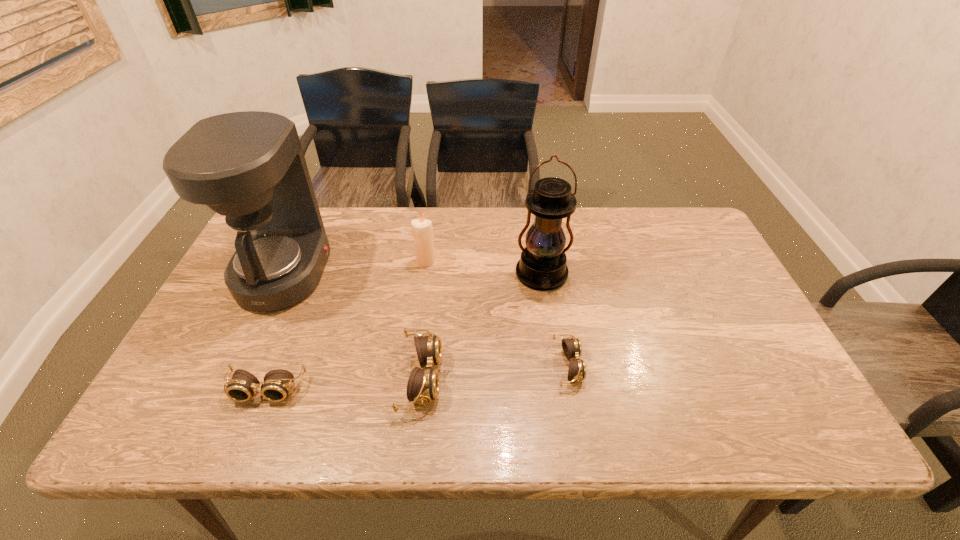
Locate an element on the screen. This screenshot has width=960, height=540. vacant area that lies between the second goggles from right to left and the second shortest goggles is located at coordinates point(344,383).

Image resolution: width=960 pixels, height=540 pixels. Identify the location of object that can be found as the second closest to the third tallest object. (249, 166).

The height and width of the screenshot is (540, 960). In order to click on object that is the second closest to the lantern in this screenshot , I will do `click(421, 228)`.

Identify which goggles is located as the second nearest to the tallest goggles. Please provide its 2D coordinates. Your answer should be formatted as a tuple, i.e. [(x, y)], where the tuple contains the x and y coordinates of a point satisfying the conditions above.

[(572, 348)]

Where is `goggles that is the closest to the second goggles from right to left`? goggles that is the closest to the second goggles from right to left is located at coordinates click(277, 383).

Locate an element on the screen. vacant point that satisfies the following two spatial constraints: 1. through the lenses of the fourth tallest object; 2. through the lenses of the leftmost goggles is located at coordinates (420, 389).

What are the coordinates of `free space in the image that satisfies the following two spatial constraints: 1. through the lenses of the shortest object; 2. through the lenses of the second shortest object` in the screenshot? It's located at coord(572,389).

Where is `vacant region that satisfies the following two spatial constraints: 1. above the fifth shortest object, indicating its light source; 2. through the lenses of the tallest goggles`? This screenshot has height=540, width=960. vacant region that satisfies the following two spatial constraints: 1. above the fifth shortest object, indicating its light source; 2. through the lenses of the tallest goggles is located at coordinates (557, 377).

This screenshot has height=540, width=960. Find the location of `free point that satisfies the following two spatial constraints: 1. above the lantern, indicating its light source; 2. through the lenses of the tallest goggles`. free point that satisfies the following two spatial constraints: 1. above the lantern, indicating its light source; 2. through the lenses of the tallest goggles is located at coordinates (557, 377).